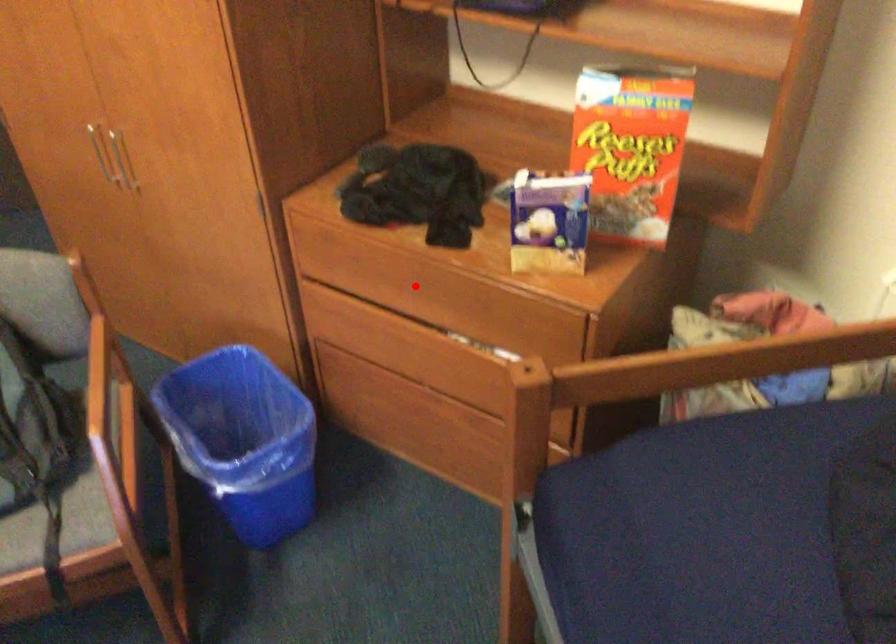
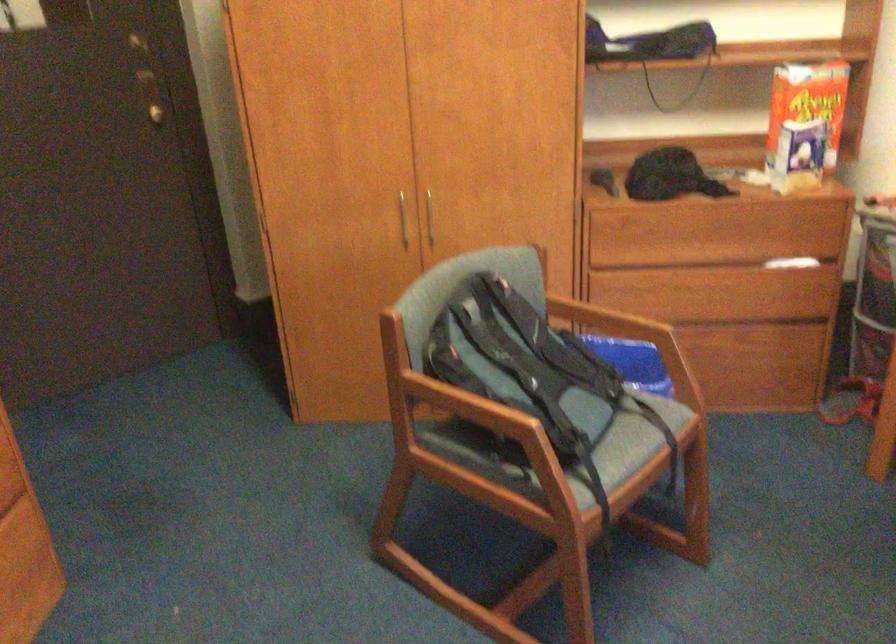
Question: A red point is marked in image1. In image2, is the corresponding 3D point closer to the camera or farther? Reply with the corresponding letter.

Choices:
 (A) The corresponding 3D point is closer.
 (B) The corresponding 3D point is farther.

Answer: (B)